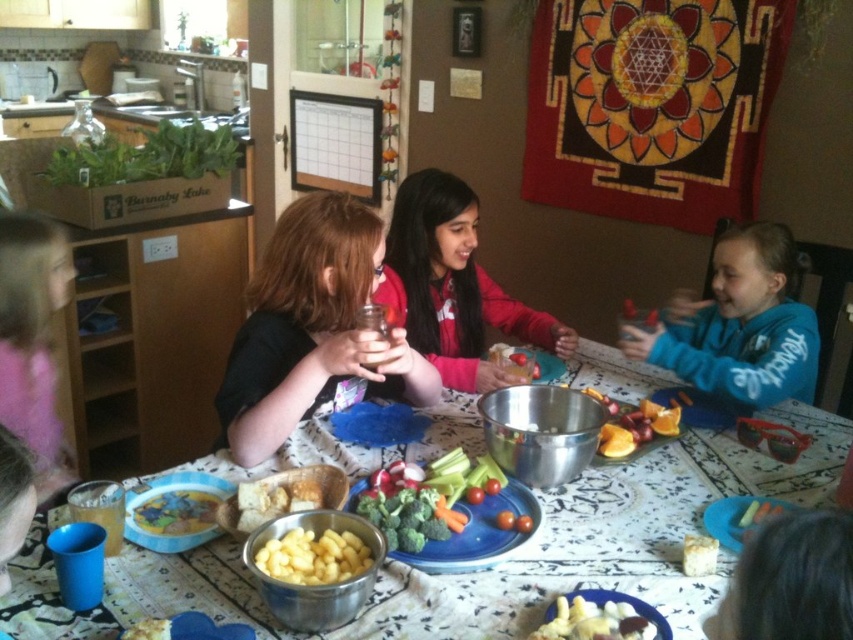
You are a photographer standing behind the dining table. You want to take a photo of both the matte black shirt at center and the matte red jacket at center. The minimum distance between them is 12.63 inches. Can you fit both subjects in a single frame if your camera has a 12 inch wide lens?

The matte black shirt at center and the matte red jacket at center are 12.63 inches apart. Since the camera lens is only 12 inches wide, it cannot capture both subjects in a single frame as the required space exceeds the lens width.

You are a photographer trying to capture a group photo of the children at the table. You notice two children wearing the matte black shirt at center and the matte red jacket at center. Since you want to ensure both are visible in the photo, which child should you position closer to the camera to avoid being obscured by others?

The matte black shirt at center has a lesser width compared to the matte red jacket at center, so positioning the child in the matte black shirt at center closer to the camera will help ensure both are visible without obstruction.

You are a parent trying to hand a smooth chocolate bar at center to your child who is sitting at the dining table. However, there is a matte black shirt at center in the way. Can you reach the chocolate bar without moving the shirt?

The matte black shirt at center is positioned over the smooth chocolate bar at center, so you cannot reach the chocolate bar without moving the shirt.